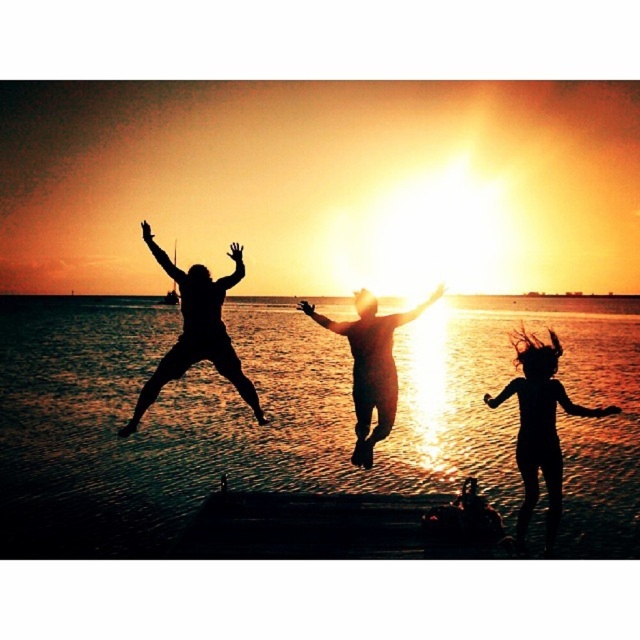
Can you confirm if black matte person at center is taller than matte black person at center?

Correct, black matte person at center is much taller as matte black person at center.

Is black matte person at center positioned in front of matte black person at center?

That is True.

This screenshot has width=640, height=640. What are the coordinates of `black matte person at center` in the screenshot? It's located at (196, 332).

In order to click on black matte person at center in this screenshot , I will do `click(196, 332)`.

Can you confirm if silhouette hair at lower right is positioned below black matte person at center?

Actually, silhouette hair at lower right is above black matte person at center.

Between point (556, 333) and point (179, 275), which one is positioned behind?

The point (556, 333) is more distant.

Locate an element on the screen. Image resolution: width=640 pixels, height=640 pixels. silhouette hair at lower right is located at coordinates (540, 428).

Does silvery water at center appear under matte black person at center?

No, silvery water at center is not below matte black person at center.

Who is positioned more to the left, silvery water at center or matte black person at center?

silvery water at center

Between point (580, 380) and point (360, 410), which one is positioned in front?

Positioned in front is point (360, 410).

Where is `silvery water at center`? This screenshot has height=640, width=640. silvery water at center is located at coordinates (294, 419).